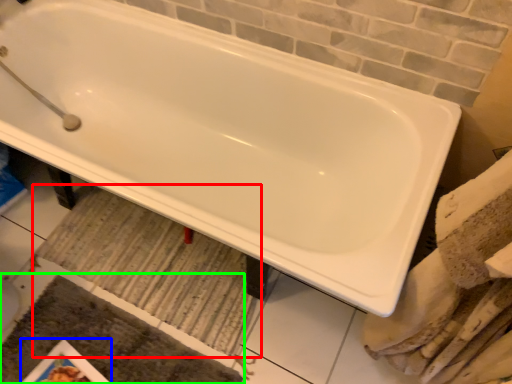
Question: Which is farther away from bath mat (highlighted by a red box)? magazine (highlighted by a blue box) or bath mat (highlighted by a green box)?

Choices:
 (A) magazine
 (B) bath mat

Answer: (A)